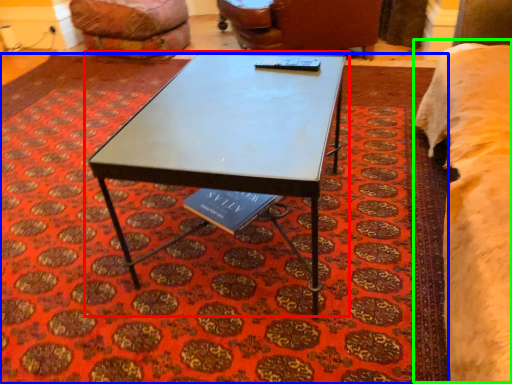
Question: Considering the real-world distances, which object is farthest from coffee table (highlighted by a red box)? mat (highlighted by a blue box) or bed (highlighted by a green box)?

Choices:
 (A) mat
 (B) bed

Answer: (B)